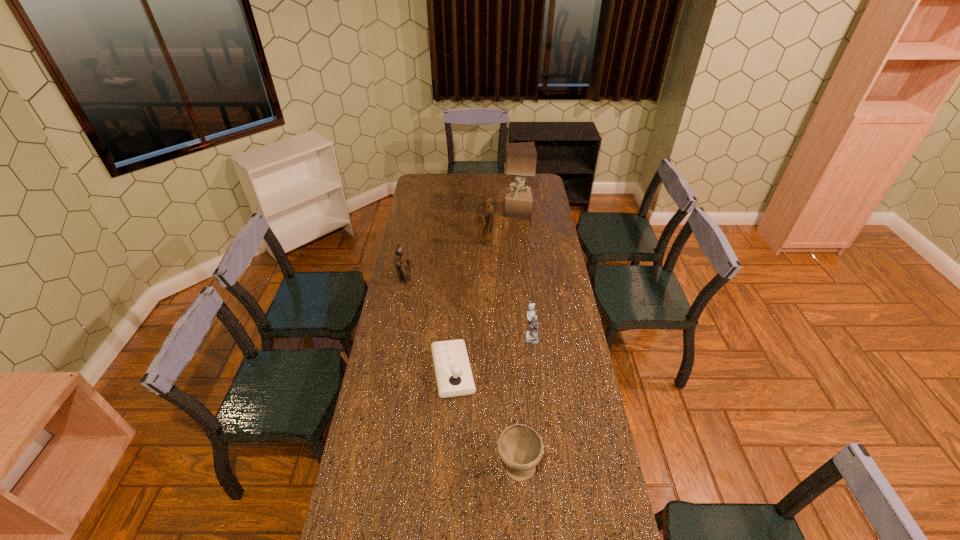
Where is `the tallest object`? Image resolution: width=960 pixels, height=540 pixels. the tallest object is located at coordinates (520, 158).

The width and height of the screenshot is (960, 540). In order to click on sculpture in this screenshot , I will do [x=520, y=158].

Where is `the farthest figurine`? Image resolution: width=960 pixels, height=540 pixels. the farthest figurine is located at coordinates (485, 212).

Image resolution: width=960 pixels, height=540 pixels. In order to click on the second figurine from right to left in this screenshot , I will do `click(485, 212)`.

The width and height of the screenshot is (960, 540). What are the coordinates of `the second nearest figurine` in the screenshot? It's located at click(x=401, y=260).

Identify the location of the leftmost figurine. (401, 260).

Where is `the rightmost figurine`? the rightmost figurine is located at coordinates (532, 336).

The height and width of the screenshot is (540, 960). I want to click on the third nearest object, so click(532, 336).

Identify the location of chalice. (520, 448).

I want to click on the nearest object, so click(x=520, y=448).